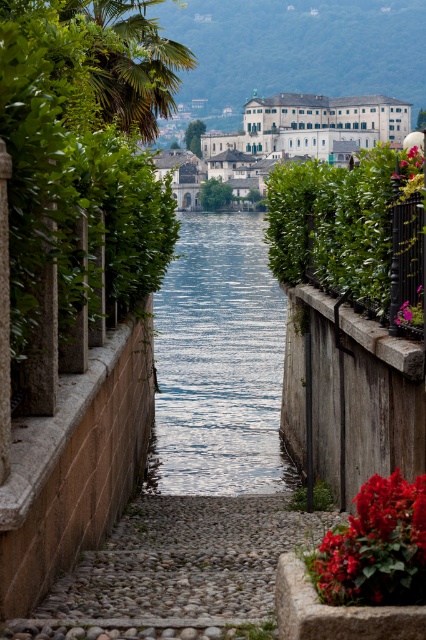
Question: Which object is the farthest from the vivid pink petals at center?

Choices:
 (A) green leafy bush at right
 (B) rustic cobblestone path at center

Answer: (A)

Question: Does green leafy plant at center come behind vivid pink petals at center?

Choices:
 (A) yes
 (B) no

Answer: (A)

Question: Which of the following is the closest to the observer?

Choices:
 (A) (400, 285)
 (B) (405, 170)

Answer: (A)

Question: From the image, what is the correct spatial relationship of rustic cobblestone path at center in relation to vivid pink petals at center?

Choices:
 (A) below
 (B) above

Answer: (A)

Question: Among these objects, which one is nearest to the camera?

Choices:
 (A) vivid pink petals at center
 (B) blue water at center
 (C) green leafy plant at center
 (D) green leafy bush at right

Answer: (A)

Question: Does blue water at center have a larger size compared to vivid red petals at lower right?

Choices:
 (A) no
 (B) yes

Answer: (B)